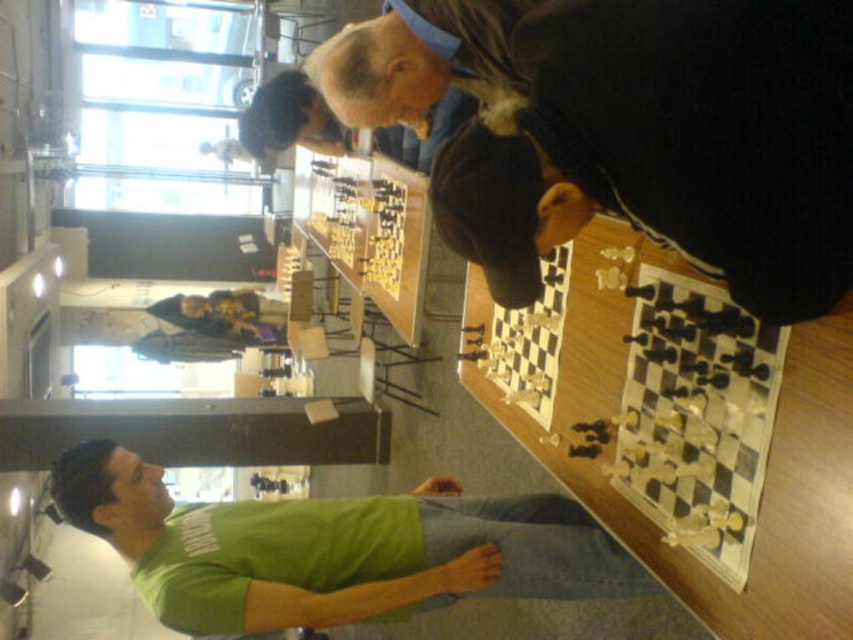
Can you confirm if black matte chessboard at upper center is positioned below green matte shirt at lower left?

No.

Between black matte chessboard at upper center and green matte shirt at lower left, which one is positioned lower?

green matte shirt at lower left is lower down.

Which is behind, point (618, 26) or point (619, 552)?

Positioned behind is point (619, 552).

This screenshot has height=640, width=853. In order to click on black matte chessboard at upper center in this screenshot , I will do click(627, 131).